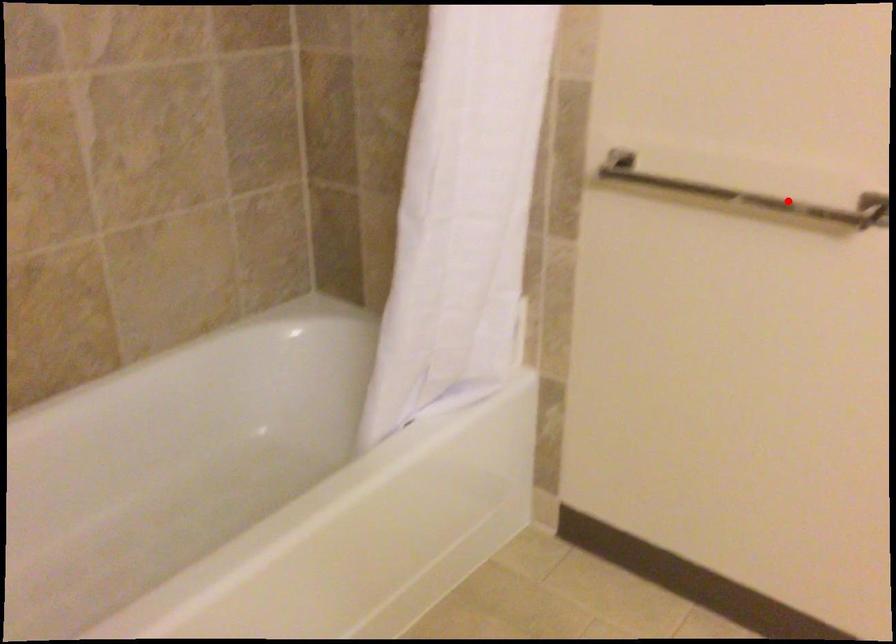
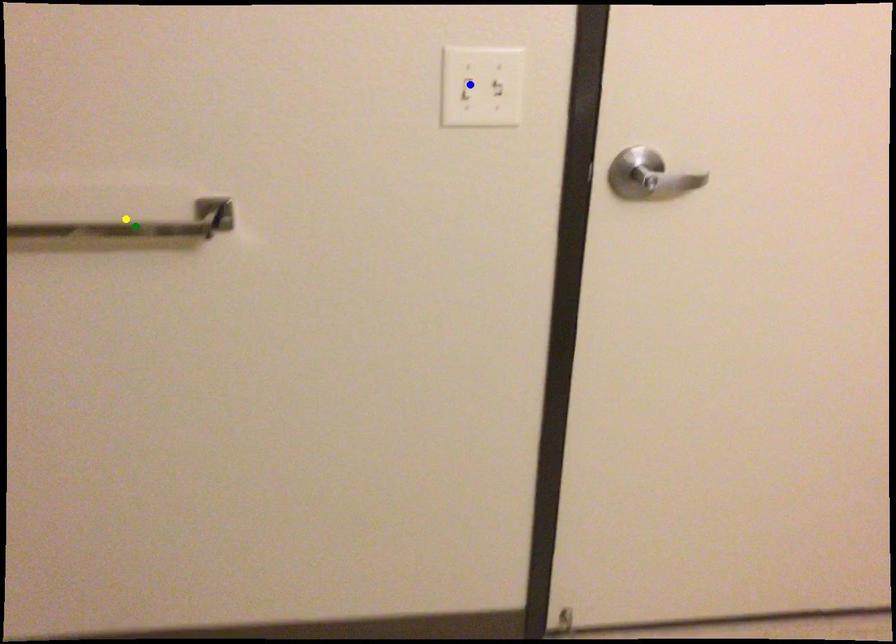
Question: I am providing you with two images of the same scene from different viewpoints. A red point is marked on the first image. You are given multiple points on the second image. In image 2, which mark is for the same physical point as the one in image 1?

Choices:
 (A) blue point
 (B) green point
 (C) yellow point

Answer: (C)